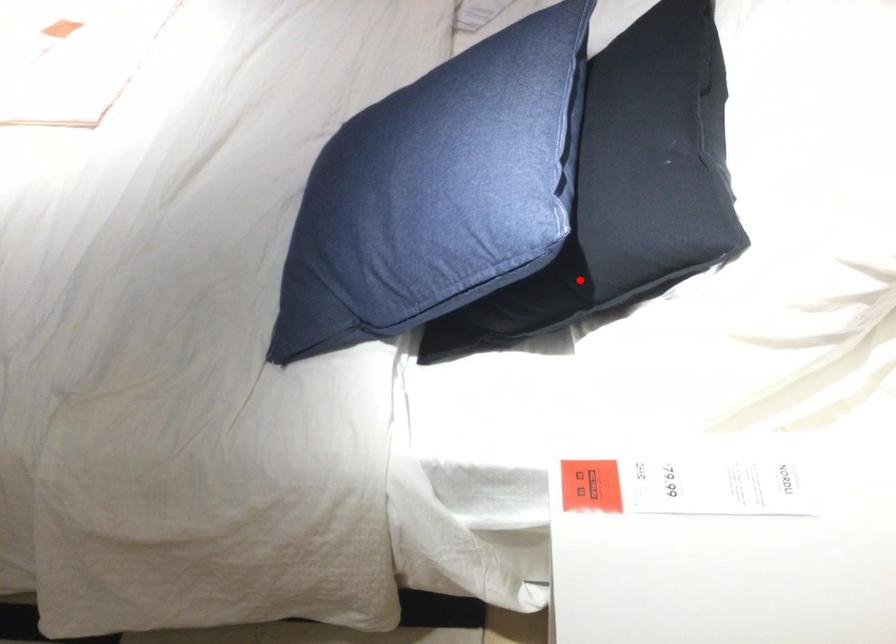
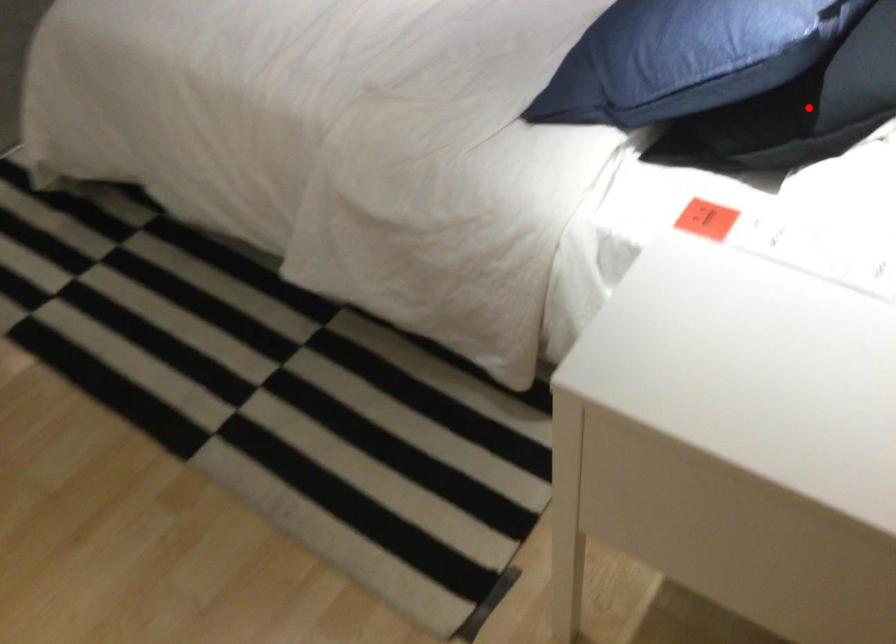
I am providing you with two images of the same scene from different viewpoints. A red point is marked on the first image and another point is marked on the second image. Does the point marked in image1 correspond to the same location as the one in image2?

Yes